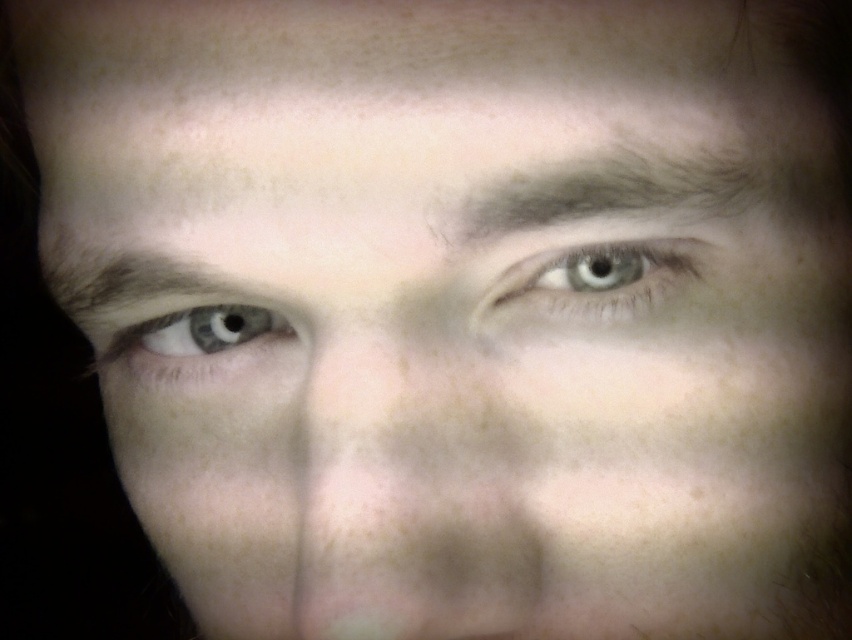
Based on the scene description, can you determine which object is closer to the viewer between the smooth skin nose at center and the dark brown hair at upper center?

The smooth skin nose at center is in front of the dark brown hair at upper center, so it is closer to the viewer.

Looking at the closeup of the person, which object has a smaller width between the smooth skin nose at center and the dark brown hair at upper center?

The smooth skin nose at center has a smaller width compared to the dark brown hair at upper center.